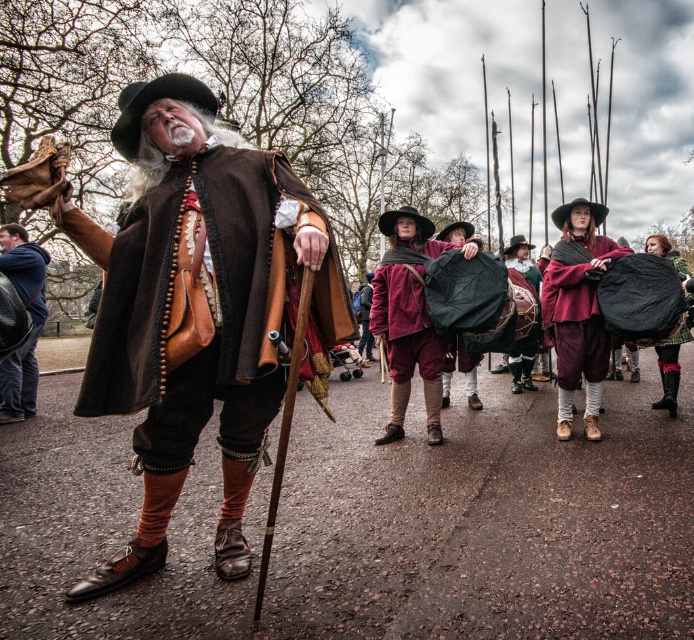
This screenshot has height=640, width=694. I want to click on maroon fabric cape at center, so click(x=577, y=312).

Can you confirm if maroon fabric cape at center is positioned to the right of matte brown leather bag at left?

Indeed, maroon fabric cape at center is positioned on the right side of matte brown leather bag at left.

Is point (593, 314) positioned behind point (19, 381)?

No, (593, 314) is in front of (19, 381).

Locate an element on the screen. The height and width of the screenshot is (640, 694). maroon fabric cape at center is located at coordinates (577, 312).

Does maroon fabric cape at center have a lesser width compared to matte purple tunic at center?

Yes, maroon fabric cape at center is thinner than matte purple tunic at center.

Is maroon fabric cape at center to the right of matte purple tunic at center from the viewer's perspective?

Indeed, maroon fabric cape at center is positioned on the right side of matte purple tunic at center.

Identify the location of maroon fabric cape at center. This screenshot has width=694, height=640. [x=577, y=312].

Who is higher up, matte brown leather bag at left or velvet burgundy cloak at center?

Positioned higher is matte brown leather bag at left.

Can you confirm if matte brown leather bag at left is positioned to the left of velvet burgundy cloak at center?

Yes, matte brown leather bag at left is to the left of velvet burgundy cloak at center.

Identify the location of matte brown leather bag at left. The image size is (694, 640). (31, 321).

The height and width of the screenshot is (640, 694). Find the location of `matte brown leather bag at left`. matte brown leather bag at left is located at coordinates (31, 321).